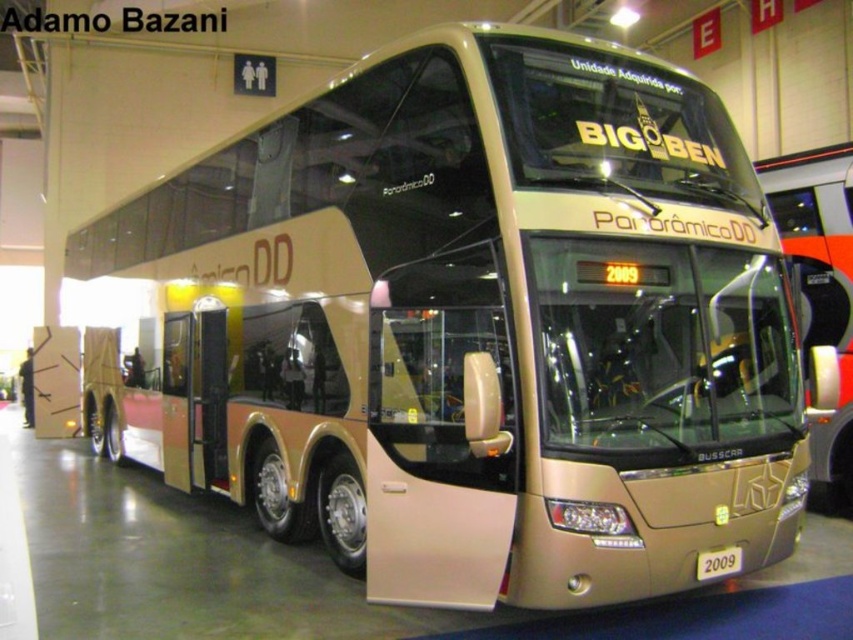
Does gold metallic bus at center appear under gold metallic license plate at center?

Actually, gold metallic bus at center is above gold metallic license plate at center.

Can you confirm if gold metallic bus at center is thinner than gold metallic license plate at center?

No.

Who is more forward, (844,467) or (697,556)?

Point (697,556) is in front.

This screenshot has height=640, width=853. Find the location of `gold metallic bus at center`. gold metallic bus at center is located at coordinates (820, 285).